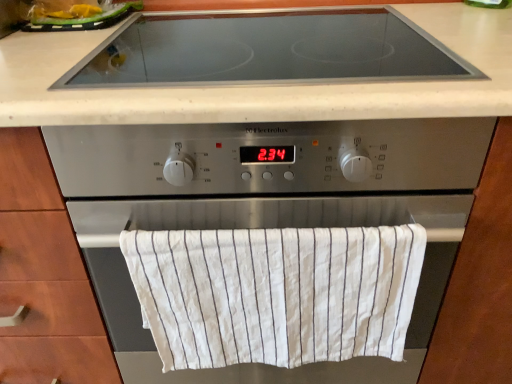
Question: From the image's perspective, is satin silver oven at center on black glass cooktop at upper center?

Choices:
 (A) no
 (B) yes

Answer: (A)

Question: Is satin silver oven at center taller than black glass cooktop at upper center?

Choices:
 (A) yes
 (B) no

Answer: (A)

Question: Could you tell me if satin silver oven at center is turned towards black glass cooktop at upper center?

Choices:
 (A) yes
 (B) no

Answer: (B)

Question: Can you confirm if satin silver oven at center is smaller than black glass cooktop at upper center?

Choices:
 (A) no
 (B) yes

Answer: (A)

Question: Can you confirm if satin silver oven at center is thinner than black glass cooktop at upper center?

Choices:
 (A) yes
 (B) no

Answer: (B)

Question: Is the depth of satin silver oven at center greater than that of black glass cooktop at upper center?

Choices:
 (A) yes
 (B) no

Answer: (B)

Question: Is black glass cooktop at upper center to the left of white striped cloth at center from the viewer's perspective?

Choices:
 (A) no
 (B) yes

Answer: (B)

Question: From a real-world perspective, is black glass cooktop at upper center positioned under white striped cloth at center based on gravity?

Choices:
 (A) no
 (B) yes

Answer: (A)

Question: Can you confirm if black glass cooktop at upper center is smaller than white striped cloth at center?

Choices:
 (A) no
 (B) yes

Answer: (A)

Question: Can you confirm if black glass cooktop at upper center is bigger than white striped cloth at center?

Choices:
 (A) yes
 (B) no

Answer: (A)

Question: Considering the relative sizes of black glass cooktop at upper center and white striped cloth at center in the image provided, is black glass cooktop at upper center taller than white striped cloth at center?

Choices:
 (A) yes
 (B) no

Answer: (B)

Question: Could you tell me if black glass cooktop at upper center is turned towards white striped cloth at center?

Choices:
 (A) yes
 (B) no

Answer: (B)

Question: From a real-world perspective, is yellow plastic bag at upper left positioned under satin silver oven at center based on gravity?

Choices:
 (A) yes
 (B) no

Answer: (B)